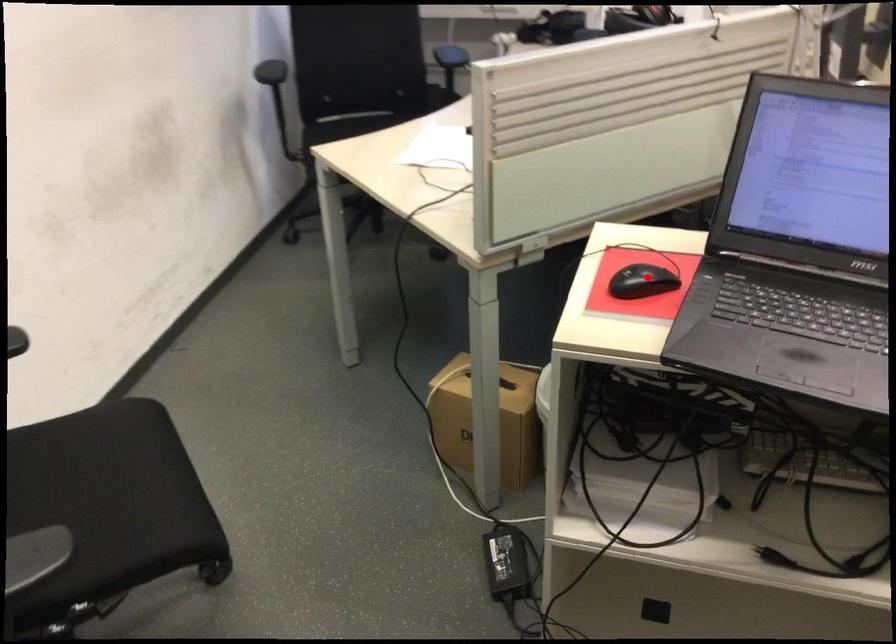
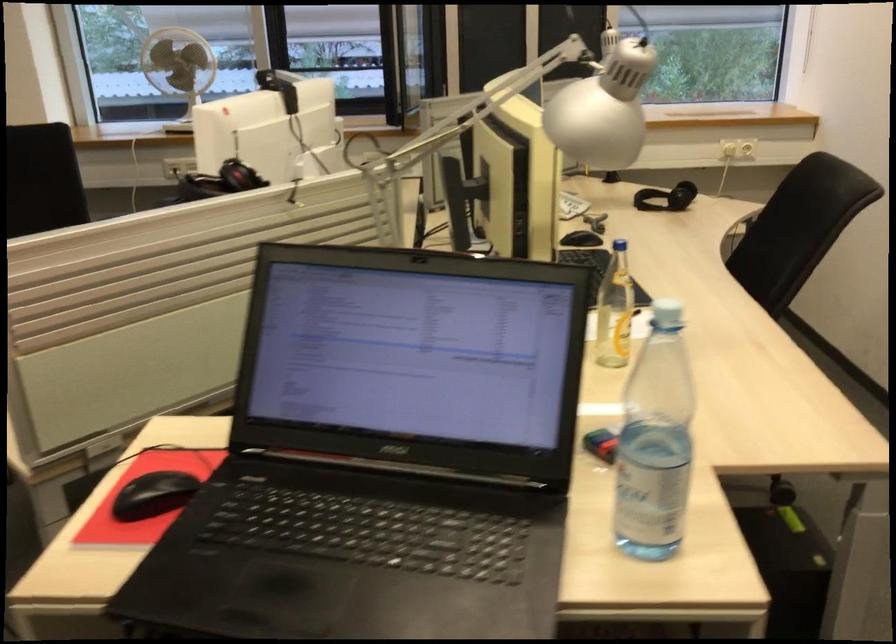
Where in the second image is the point corresponding to the highlighted location from the first image?

(153, 495)